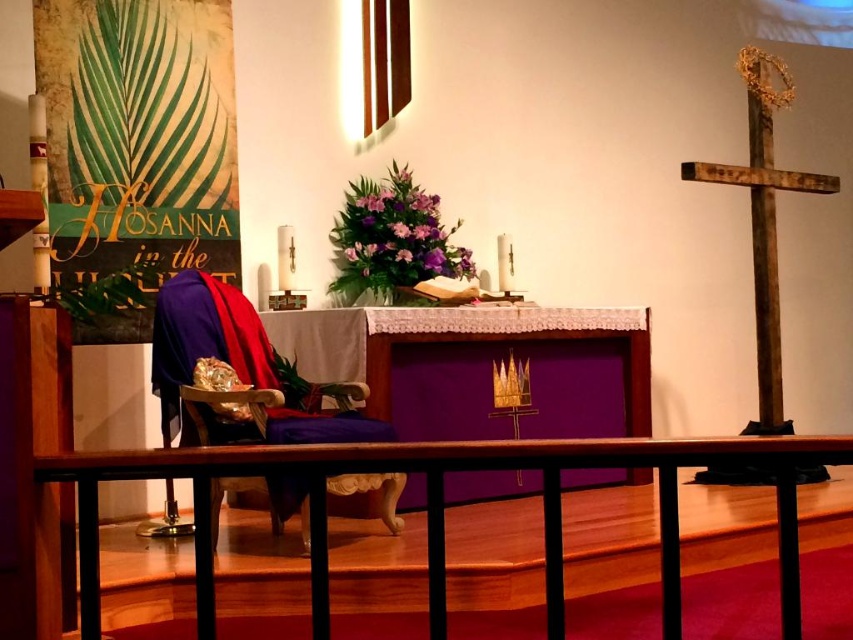
Question: Is brown wooden rail at lower center thinner than wooden cross at right?

Choices:
 (A) yes
 (B) no

Answer: (B)

Question: Is purple velvet chair at center to the left of wooden cross at right from the viewer's perspective?

Choices:
 (A) no
 (B) yes

Answer: (B)

Question: Which point is farther to the camera?

Choices:
 (A) brown wooden rail at lower center
 (B) wooden cross at right

Answer: (B)

Question: Which of the following is the farthest from the observer?

Choices:
 (A) wooden cross at right
 (B) brown wooden rail at lower center

Answer: (A)

Question: Which object is the farthest from the wooden cross at right?

Choices:
 (A) brown wooden rail at lower center
 (B) purple velvet chair at center

Answer: (A)

Question: Does brown wooden rail at lower center have a smaller size compared to purple velvet chair at center?

Choices:
 (A) yes
 (B) no

Answer: (A)